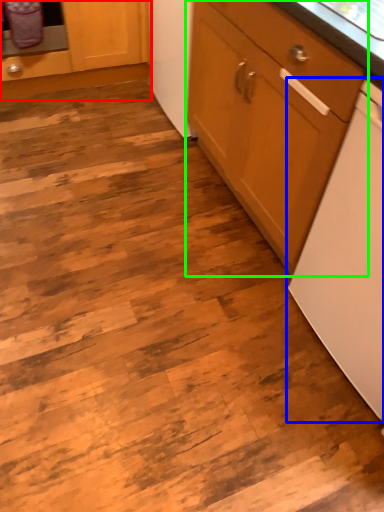
Question: Based on their relative distances, which object is nearer to cabinetry (highlighted by a red box)? Choose from home appliance (highlighted by a blue box) and cabinetry (highlighted by a green box).

Choices:
 (A) home appliance
 (B) cabinetry

Answer: (B)